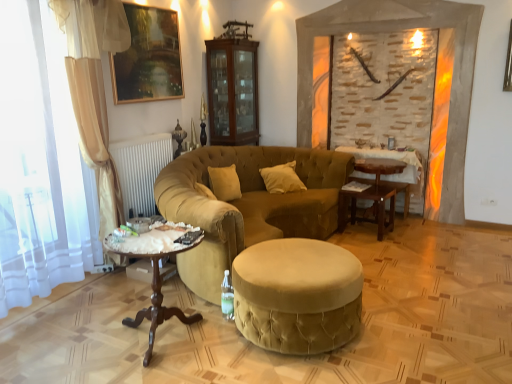
Question: Is the surface of white velvet pillow at center in direct contact with stone textured fireplace at center?

Choices:
 (A) no
 (B) yes

Answer: (A)

Question: Is white velvet pillow at center thinner than stone textured fireplace at center?

Choices:
 (A) yes
 (B) no

Answer: (B)

Question: Is white velvet pillow at center wider than stone textured fireplace at center?

Choices:
 (A) no
 (B) yes

Answer: (B)

Question: Is white velvet pillow at center positioned with its back to stone textured fireplace at center?

Choices:
 (A) yes
 (B) no

Answer: (B)

Question: Can you confirm if white velvet pillow at center is shorter than stone textured fireplace at center?

Choices:
 (A) yes
 (B) no

Answer: (A)

Question: Is wooden polished table at lower left situated inside white velvet pillow at center or outside?

Choices:
 (A) outside
 (B) inside

Answer: (A)

Question: Considering the positions of wooden polished table at lower left and white velvet pillow at center in the image, is wooden polished table at lower left taller or shorter than white velvet pillow at center?

Choices:
 (A) short
 (B) tall

Answer: (B)

Question: From a real-world perspective, relative to white velvet pillow at center, is wooden polished table at lower left vertically above or below?

Choices:
 (A) above
 (B) below

Answer: (B)

Question: Considering the positions of wooden polished table at lower left and white velvet pillow at center in the image, is wooden polished table at lower left wider or thinner than white velvet pillow at center?

Choices:
 (A) thin
 (B) wide

Answer: (B)

Question: From the image's perspective, is wooden table at center, the 1th table positioned from the front, above or below gold-framed painting at upper center?

Choices:
 (A) above
 (B) below

Answer: (B)

Question: Would you say wooden table at center, placed as the second table when sorted from back to front, is to the left or to the right of gold-framed painting at upper center in the picture?

Choices:
 (A) right
 (B) left

Answer: (A)

Question: Looking at their shapes, would you say wooden table at center, the 1th table positioned from the front, is wider or thinner than gold-framed painting at upper center?

Choices:
 (A) wide
 (B) thin

Answer: (A)

Question: Is point (361, 182) positioned closer to the camera than point (168, 62)?

Choices:
 (A) closer
 (B) farther

Answer: (B)

Question: Is white sheer curtain at left to the left or to the right of velvet gold studio couch at center in the image?

Choices:
 (A) right
 (B) left

Answer: (B)

Question: Considering the positions of white sheer curtain at left and velvet gold studio couch at center in the image, is white sheer curtain at left bigger or smaller than velvet gold studio couch at center?

Choices:
 (A) small
 (B) big

Answer: (A)